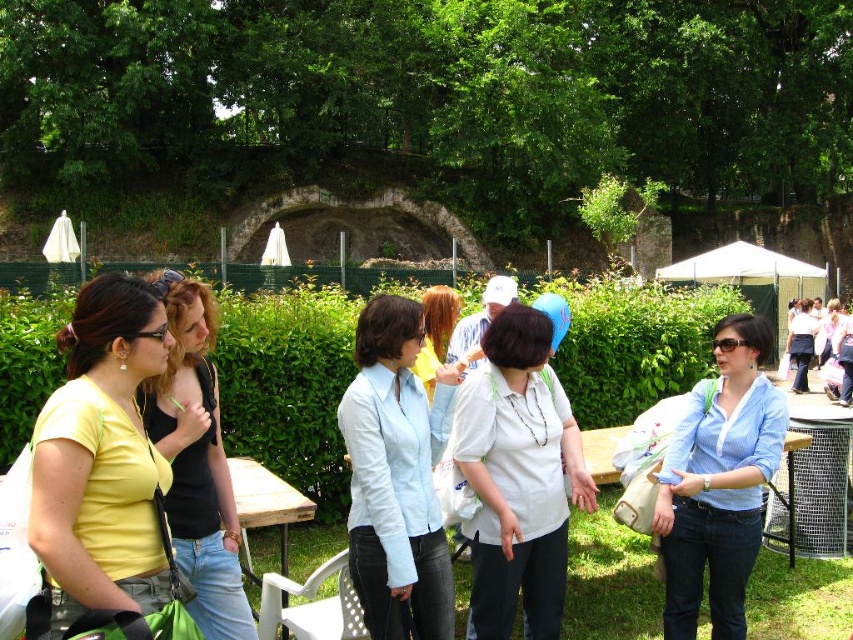
Does matte black top at left have a lesser width compared to white cotton shirt at center?

Yes.

Which is in front, point (194, 595) or point (790, 340)?

Point (194, 595) is in front.

Find the location of a particular element. This screenshot has width=853, height=640. matte black top at left is located at coordinates (196, 461).

This screenshot has height=640, width=853. I want to click on matte black top at left, so click(x=196, y=461).

Is point (51, 573) closer to viewer compared to point (496, 636)?

That is True.

Can you confirm if matte yellow shirt at left is positioned below white matte shirt at center?

Correct, matte yellow shirt at left is located below white matte shirt at center.

Does point (111, 497) lie in front of point (560, 570)?

That is True.

You are a GUI agent. You are given a task and a screenshot of the screen. Output one action in this format:
    pyautogui.click(x=<x>, y=<y>)
    Task: Click on the matte yellow shirt at left
    The image size is (853, 640).
    Given the screenshot: What is the action you would take?
    pyautogui.click(x=102, y=464)

Consider the image. Is blue striped shirt at center closer to the viewer compared to light brown hair at center?

Yes.

This screenshot has width=853, height=640. Find the location of `blue striped shirt at center`. blue striped shirt at center is located at coordinates (718, 483).